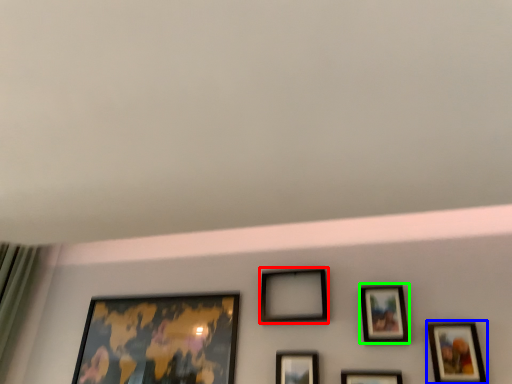
Question: Based on their relative distances, which object is farther from picture frame (highlighted by a red box)? Choose from picture frame (highlighted by a blue box) and picture frame (highlighted by a green box).

Choices:
 (A) picture frame
 (B) picture frame

Answer: (A)